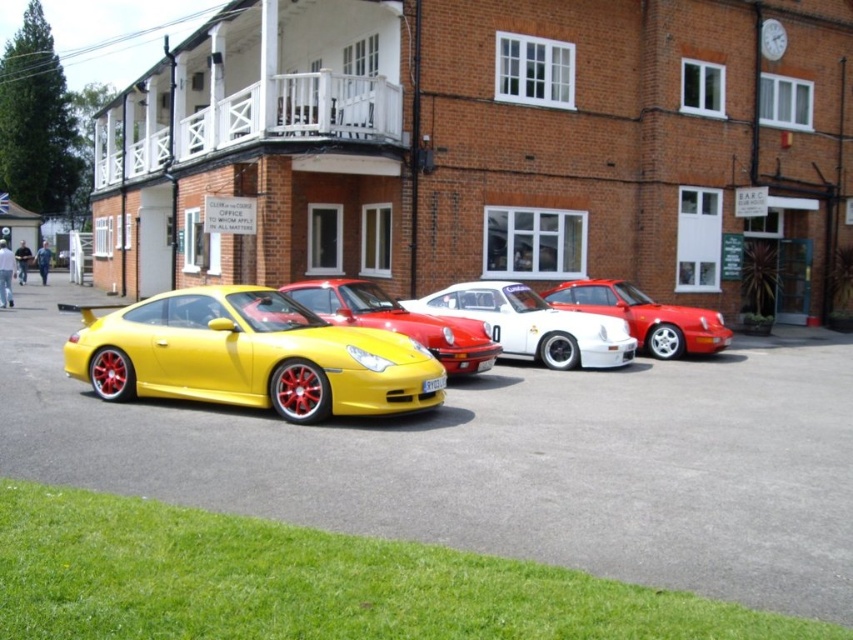
You are a photographer trying to capture the shiny red porsche at center and the matte yellow sports car at left in a single shot. Since you want the red porsche to appear larger in the photo, which car should you move closer to?

To make the shiny red porsche at center appear larger in the photo, you should move closer to the shiny red porsche at center. However, since the matte yellow sports car at left is taller than the shiny red porsche at center, moving closer to the red porsche would help emphasize its size relative to the yellow car in the frame.